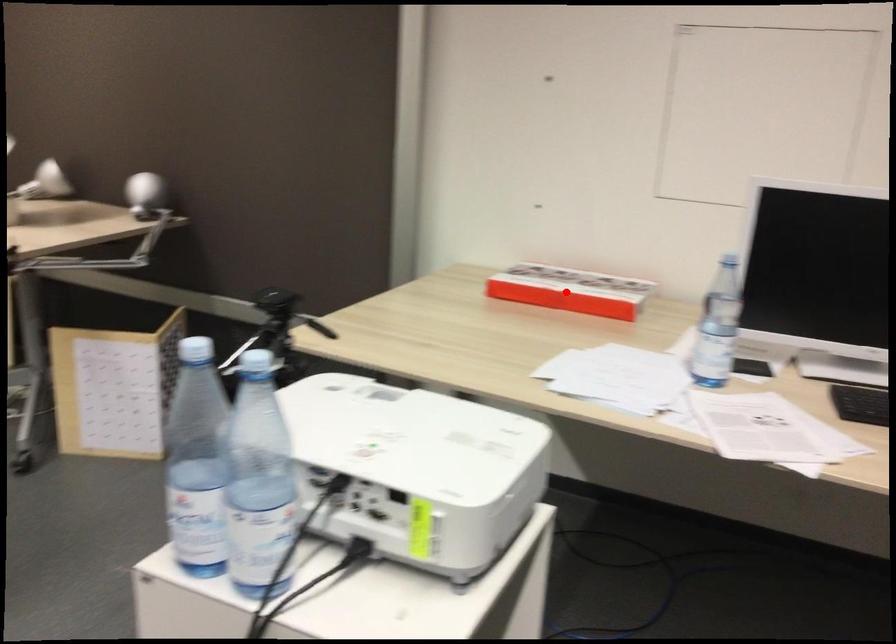
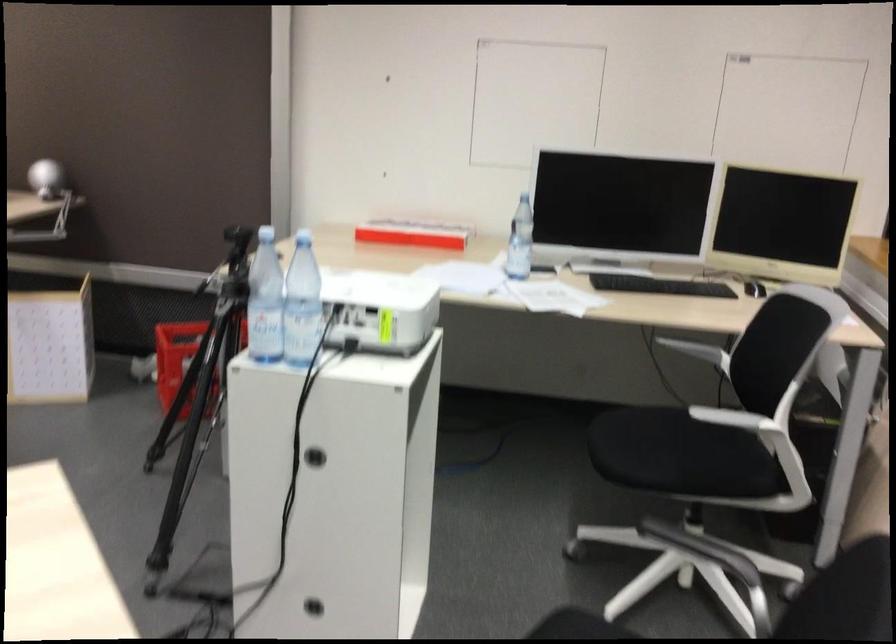
In the second image, find the point that corresponds to the highlighted location in the first image.

(412, 234)